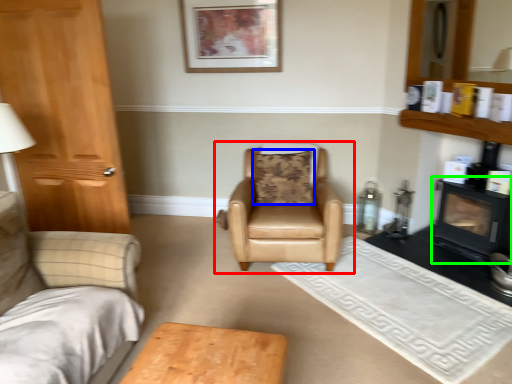
Question: Based on their relative distances, which object is nearer to chair (highlighted by a red box)? Choose from pillow (highlighted by a blue box) and fireplace (highlighted by a green box).

Choices:
 (A) pillow
 (B) fireplace

Answer: (A)